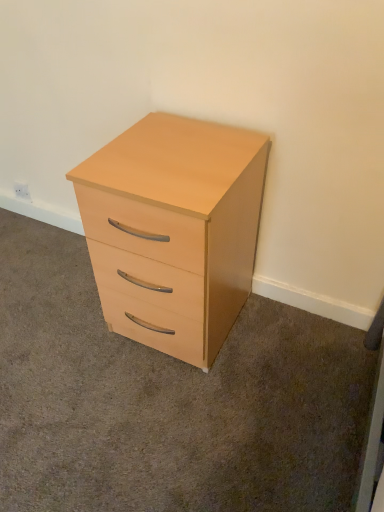
Identify the location of free location to the left of light wood/finish chest of drawers at center. The height and width of the screenshot is (512, 384). (59, 324).